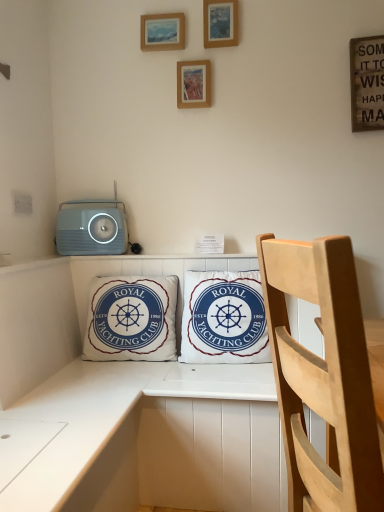
Question: Is white cotton pillow at center, the 1th pillow from the right, far away from wooden picture frame at upper center, the 3th picture frame when ordered from bottom to top?

Choices:
 (A) no
 (B) yes

Answer: (B)

Question: Is white cotton pillow at center, the 1th pillow from the right, closer to the viewer compared to wooden picture frame at upper center, arranged as the 1th picture frame when viewed from the right?

Choices:
 (A) yes
 (B) no

Answer: (A)

Question: Would you say wooden picture frame at upper center, arranged as the 1th picture frame when viewed from the right, is part of white cotton pillow at center, the 1th pillow from the right,'s contents?

Choices:
 (A) yes
 (B) no

Answer: (B)

Question: Could you tell me if white cotton pillow at center, the 1th pillow from the right, is turned towards wooden picture frame at upper center, which is the first picture frame in top-to-bottom order?

Choices:
 (A) no
 (B) yes

Answer: (A)

Question: Considering the relative positions of white cotton pillow at center, the 1th pillow from the right, and wooden picture frame at upper center, the 3th picture frame when ordered from bottom to top, in the image provided, is white cotton pillow at center, the 1th pillow from the right, to the left of wooden picture frame at upper center, the 3th picture frame when ordered from bottom to top, from the viewer's perspective?

Choices:
 (A) yes
 (B) no

Answer: (A)

Question: Choose the correct answer: Is wooden picture frame at upper center, which appears as the third picture frame when viewed from the top, inside white cotton cushion at center, the 1th pillow in the left-to-right sequence, or outside it?

Choices:
 (A) inside
 (B) outside

Answer: (B)

Question: From the image's perspective, is wooden picture frame at upper center, placed as the second picture frame when sorted from right to left, above or below white cotton cushion at center, arranged as the 2th pillow when viewed from the right?

Choices:
 (A) below
 (B) above

Answer: (B)

Question: In terms of width, does wooden picture frame at upper center, placed as the second picture frame when sorted from right to left, look wider or thinner when compared to white cotton cushion at center, arranged as the 2th pillow when viewed from the right?

Choices:
 (A) thin
 (B) wide

Answer: (A)

Question: From a real-world perspective, is wooden picture frame at upper center, placed as the second picture frame when sorted from right to left, above or below white cotton cushion at center, the 1th pillow in the left-to-right sequence?

Choices:
 (A) below
 (B) above

Answer: (B)

Question: Is white cotton pillow at center, the 1th pillow from the right, wider or thinner than wooden picture frame at upper center, placed as the second picture frame when sorted from right to left?

Choices:
 (A) thin
 (B) wide

Answer: (B)

Question: Looking at the image, does white cotton pillow at center, the 1th pillow from the right, seem bigger or smaller compared to wooden picture frame at upper center, placed as the second picture frame when sorted from right to left?

Choices:
 (A) small
 (B) big

Answer: (B)

Question: Is white cotton pillow at center, the 1th pillow from the right, in front of or behind wooden picture frame at upper center, placed as the second picture frame when sorted from right to left, in the image?

Choices:
 (A) behind
 (B) front

Answer: (B)

Question: Considering the positions of point (190, 353) and point (187, 75), is point (190, 353) closer or farther from the camera than point (187, 75)?

Choices:
 (A) closer
 (B) farther

Answer: (A)

Question: From a real-world perspective, relative to wooden picture frame at upper center, positioned as the 2th picture frame in bottom-to-top order, is white cotton cushion at center, the 1th pillow in the left-to-right sequence, vertically above or below?

Choices:
 (A) above
 (B) below

Answer: (B)

Question: Is point pyautogui.click(x=125, y=285) positioned closer to the camera than point pyautogui.click(x=167, y=17)?

Choices:
 (A) closer
 (B) farther

Answer: (A)